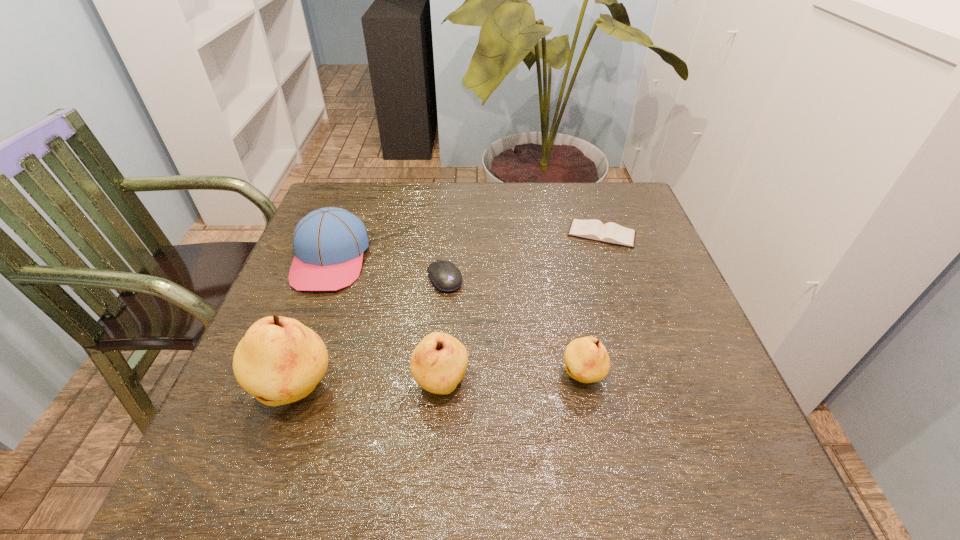
The image size is (960, 540). Find the location of `the tallest pear`. the tallest pear is located at coordinates (279, 360).

The image size is (960, 540). Identify the location of the leftmost pear. (279, 360).

Locate an element on the screen. the second shortest pear is located at coordinates (438, 363).

Locate an element on the screen. This screenshot has width=960, height=540. the fifth shortest object is located at coordinates (438, 363).

Identify the location of the shortest pear. (586, 359).

Locate an element on the screen. The image size is (960, 540). computer mouse is located at coordinates (445, 276).

The width and height of the screenshot is (960, 540). Find the location of `the shortest object`. the shortest object is located at coordinates (612, 233).

This screenshot has width=960, height=540. I want to click on baseball cap, so point(328,243).

Image resolution: width=960 pixels, height=540 pixels. Find the location of `blank area located 0.400m on the right of the leftmost pear`. blank area located 0.400m on the right of the leftmost pear is located at coordinates (555, 392).

Locate an element on the screen. The height and width of the screenshot is (540, 960). free space located 0.230m on the right of the fifth shortest object is located at coordinates (592, 384).